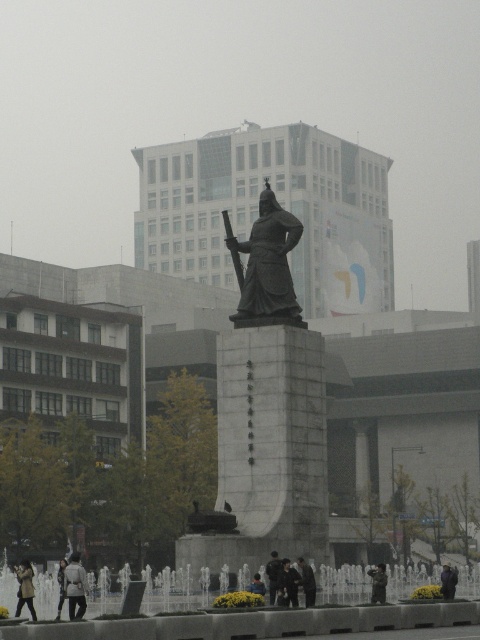
Based on the photo, does light gray jacket at lower left appear over dark gray suit at center?

Incorrect, light gray jacket at lower left is not positioned above dark gray suit at center.

Between point (25, 579) and point (298, 563), which one is positioned in front?

Point (25, 579) is in front.

Find the location of a particular element. light gray jacket at lower left is located at coordinates (24, 588).

Does dark blue fabric jacket at center come in front of blue denim jacket at center?

No.

Can you confirm if dark blue fabric jacket at center is shorter than blue denim jacket at center?

No.

The height and width of the screenshot is (640, 480). I want to click on dark blue fabric jacket at center, so click(447, 580).

Who is taller, light gray coat at center or light gray jacket at lower left?

light gray coat at center is taller.

Between light gray coat at center and light gray jacket at lower left, which one appears on the right side from the viewer's perspective?

light gray coat at center

In order to click on light gray coat at center in this screenshot , I will do `click(75, 586)`.

This screenshot has width=480, height=640. Identify the location of light gray coat at center. (75, 586).